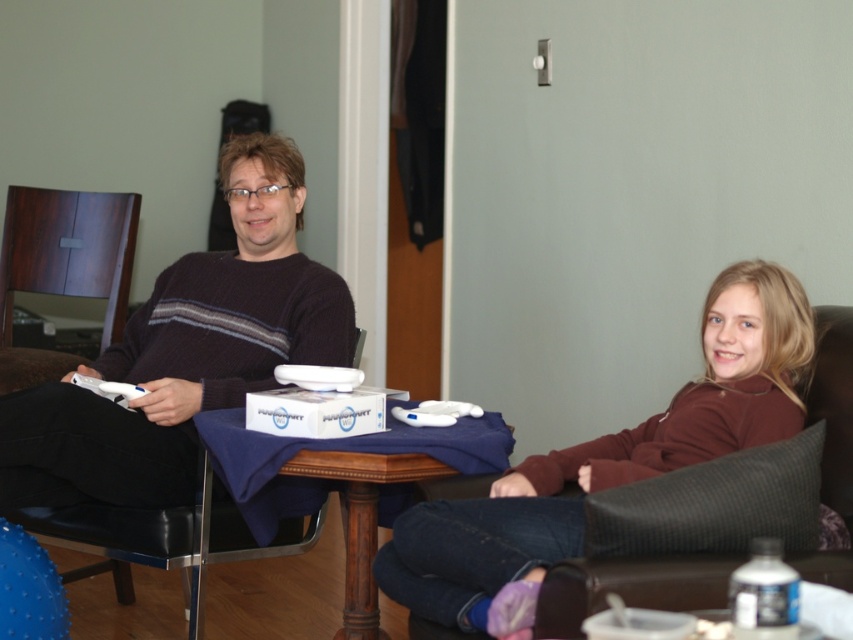
Question: From the image, what is the correct spatial relationship of dark brown sweater at center in relation to dark wood chair at left?

Choices:
 (A) above
 (B) below

Answer: (B)

Question: Does dark brown sweater at center have a lesser width compared to brown fleece sweater at center?

Choices:
 (A) yes
 (B) no

Answer: (A)

Question: Which object appears closest to the camera in this image?

Choices:
 (A) dark brown sweater at center
 (B) wooden table at center

Answer: (B)

Question: Does dark brown sweater at center have a greater width compared to wooden table at center?

Choices:
 (A) no
 (B) yes

Answer: (B)

Question: Which object appears closest to the camera in this image?

Choices:
 (A) brown fleece sweater at center
 (B) dark wood chair at left

Answer: (A)

Question: Which point appears farthest from the camera in this image?

Choices:
 (A) (422, 563)
 (B) (216, 476)
 (C) (91, 260)

Answer: (C)